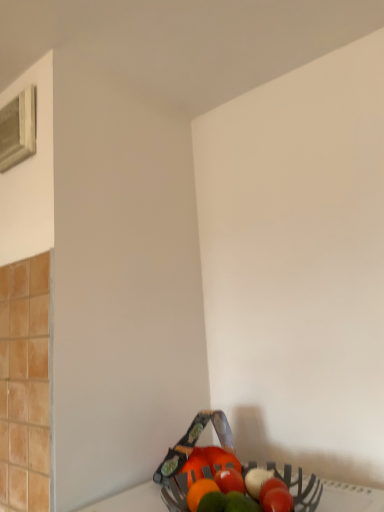
Question: Does white wood window at upper left come behind metallic basket at lower right?

Choices:
 (A) no
 (B) yes

Answer: (B)

Question: From the image's perspective, is white wood window at upper left above metallic basket at lower right?

Choices:
 (A) yes
 (B) no

Answer: (A)

Question: Is white wood window at upper left oriented away from metallic basket at lower right?

Choices:
 (A) no
 (B) yes

Answer: (A)

Question: Can you confirm if white wood window at upper left is positioned to the right of metallic basket at lower right?

Choices:
 (A) no
 (B) yes

Answer: (A)

Question: From the image's perspective, is white wood window at upper left beneath metallic basket at lower right?

Choices:
 (A) yes
 (B) no

Answer: (B)

Question: Is white wood window at upper left positioned in front of metallic basket at lower right?

Choices:
 (A) yes
 (B) no

Answer: (B)

Question: Does metallic basket at lower right come behind white wood window at upper left?

Choices:
 (A) yes
 (B) no

Answer: (B)

Question: From the image's perspective, does metallic basket at lower right appear higher than white wood window at upper left?

Choices:
 (A) yes
 (B) no

Answer: (B)

Question: Is metallic basket at lower right beside white wood window at upper left?

Choices:
 (A) no
 (B) yes

Answer: (A)

Question: Is metallic basket at lower right to the left of white wood window at upper left from the viewer's perspective?

Choices:
 (A) yes
 (B) no

Answer: (B)

Question: From the image's perspective, would you say metallic basket at lower right is shown under white wood window at upper left?

Choices:
 (A) no
 (B) yes

Answer: (B)

Question: Does metallic basket at lower right have a greater height compared to white wood window at upper left?

Choices:
 (A) no
 (B) yes

Answer: (A)

Question: Considering the positions of point (354, 483) and point (26, 101), is point (354, 483) closer or farther from the camera than point (26, 101)?

Choices:
 (A) farther
 (B) closer

Answer: (B)